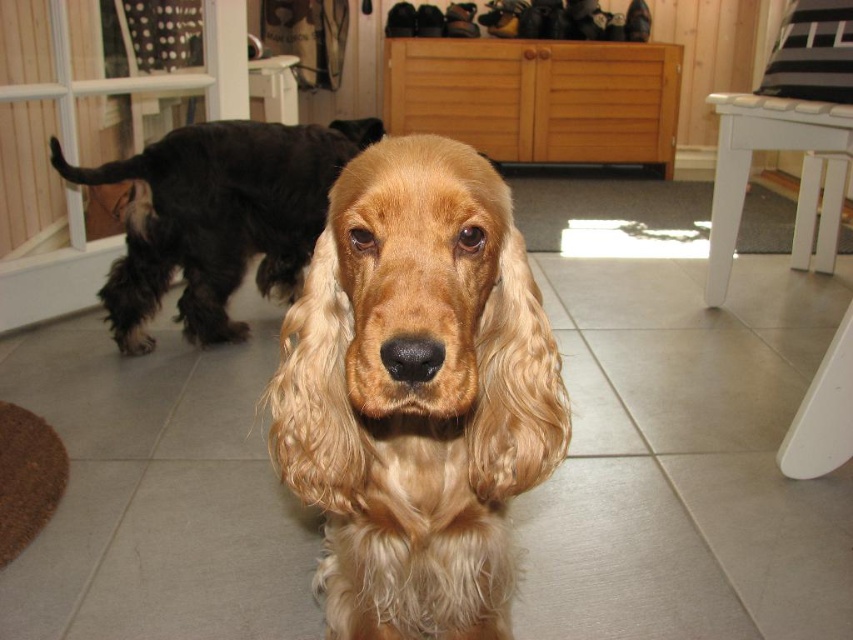
You are a visitor at a home and see the golden fur dog at center and the black fuzzy dog at left. Which dog is closer to you?

The golden fur dog at center is closer to you because it is positioned under the black fuzzy dog at left, indicating it is in front of the other dog.

You are standing at the entrance of the room. There is a point marked at coordinates (416, 394). What object is located at that point?

The point at coordinates (416, 394) indicates the golden fur dog at center.